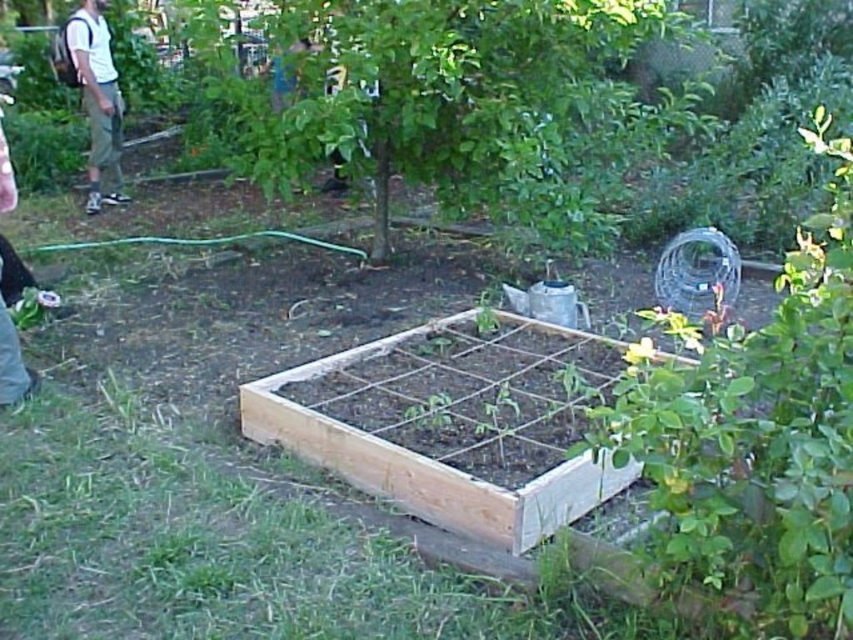
Question: Which point appears farthest from the camera in this image?

Choices:
 (A) (468, 396)
 (B) (683, 16)
 (C) (76, 22)

Answer: (C)

Question: Does green leafy tree at center have a lesser width compared to natural wood flower bed at center?

Choices:
 (A) no
 (B) yes

Answer: (A)

Question: Among these points, which one is nearest to the camera?

Choices:
 (A) (109, 33)
 (B) (323, 147)

Answer: (B)

Question: Which of the following is the farthest from the observer?

Choices:
 (A) white cotton shirt at upper left
 (B) natural wood flower bed at center
 (C) green leafy tree at center

Answer: (A)

Question: Does green leafy tree at center have a smaller size compared to white cotton shirt at upper left?

Choices:
 (A) no
 (B) yes

Answer: (A)

Question: Is green leafy tree at center positioned behind white cotton shirt at upper left?

Choices:
 (A) yes
 (B) no

Answer: (B)